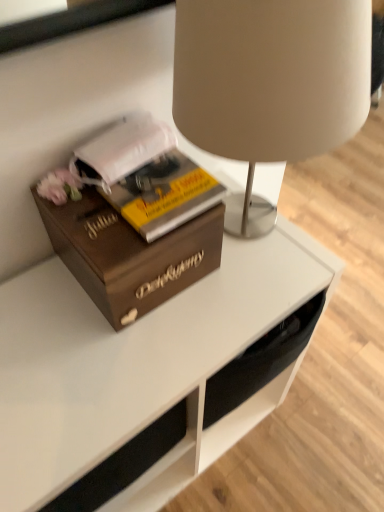
I want to click on empty space that is ontop of wooden box at left (from a real-world perspective), so click(125, 193).